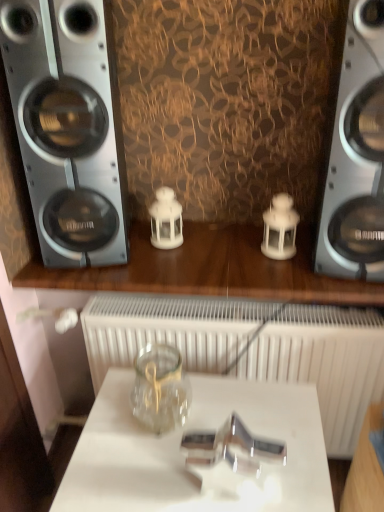
At what (x,y) coordinates should I click in order to perform the action: click on vacant area to the right of silver metallic speaker at left, placed as the 1th home appliance when sorted from left to right. Please return your answer as a coordinate pair (x, y). Looking at the image, I should click on (173, 249).